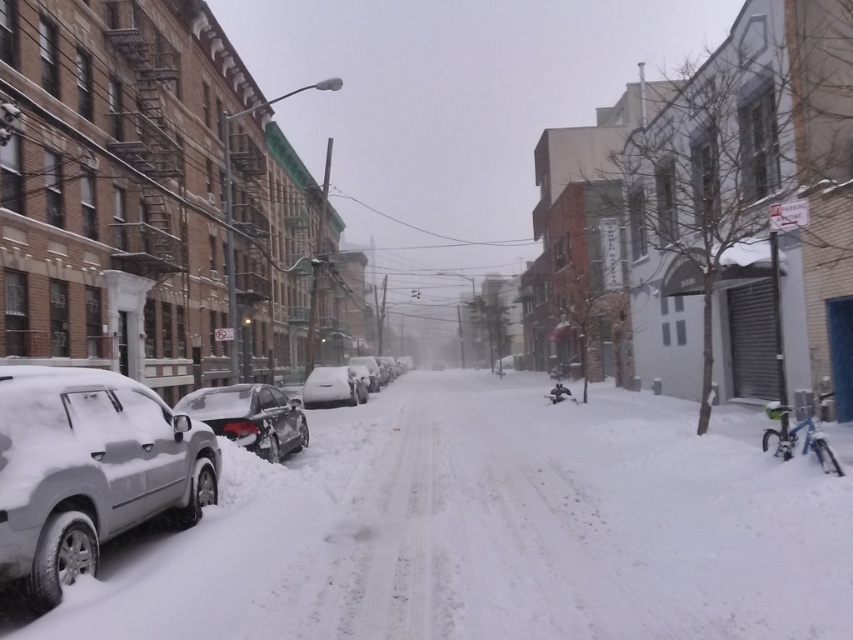
You are a snowplow operator trying to clear the street. You see the white fluffy snow at lower left and the sleek metallic car at lower left. Which area should you clear first if the car needs to exit immediately?

The sleek metallic car at lower left needs to be cleared first since it is obstructed by the white fluffy snow at lower left, which is wider and might be covering the car, making it harder to move.

You are standing at the point marked as point (x=492, y=529) in the snowy urban street scene. Looking around, you notice white fluffy snow at lower left. Which direction should you walk to reach the white fluffy snow at lower left?

You are already at the white fluffy snow at lower left because the point (x=492, y=529) is located on it.